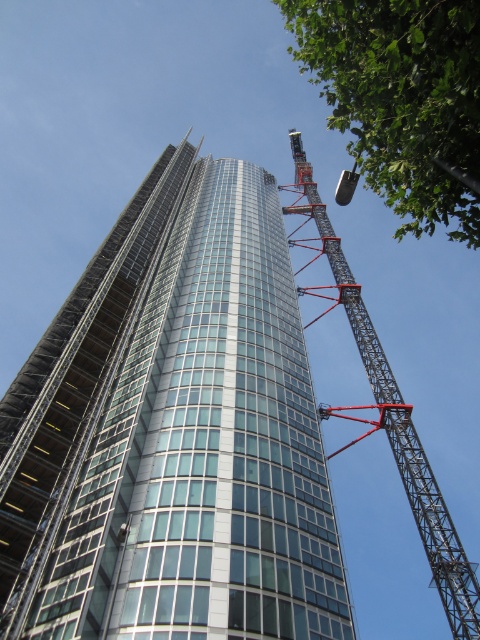
Between point (364, 346) and point (350, 186), which one is positioned in front?

Point (364, 346) is more forward.

Between metallic gray crane at right and metallic gray crane at upper right, which one appears on the left side from the viewer's perspective?

metallic gray crane at right

The width and height of the screenshot is (480, 640). I want to click on metallic gray crane at right, so click(393, 417).

Which of these two, green leafy tree at upper right or metallic gray crane at right, stands shorter?

green leafy tree at upper right is shorter.

Is point (462, 12) more distant than point (407, 432)?

No, (462, 12) is in front of (407, 432).

Who is more forward, (439, 209) or (395, 413)?

Point (439, 209) is in front.

The image size is (480, 640). In order to click on green leafy tree at upper right in this screenshot , I will do `click(402, 99)`.

Which is behind, point (84, 541) or point (416, 454)?

Point (416, 454)

Is glassy steel skyscraper at center to the left of metallic gray crane at right from the viewer's perspective?

Indeed, glassy steel skyscraper at center is positioned on the left side of metallic gray crane at right.

Is point (175, 424) more distant than point (420, 512)?

No, it is not.

Identify the location of glassy steel skyscraper at center. The height and width of the screenshot is (640, 480). (173, 433).